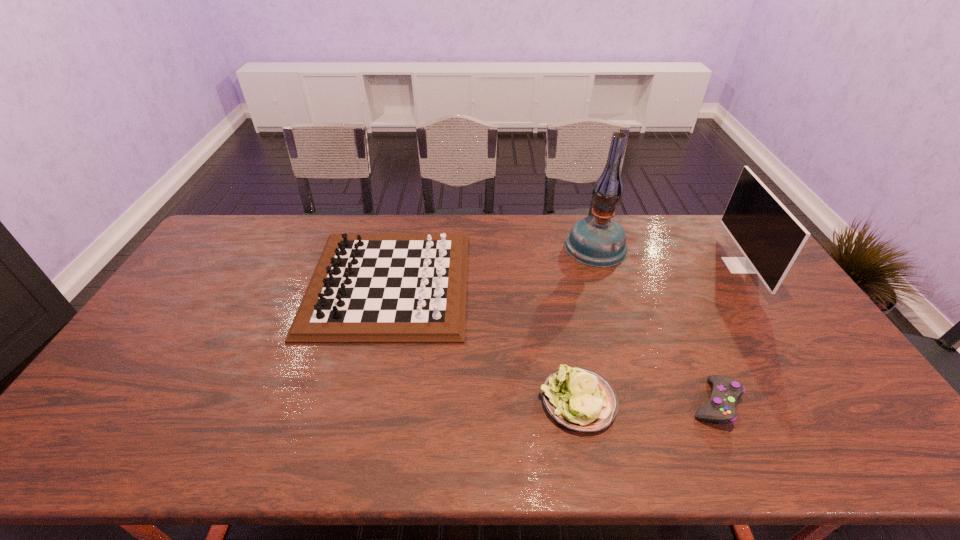
The image size is (960, 540). Identify the location of vacant area between the second shortest object and the leftmost object. (483, 342).

Locate an element on the screen. This screenshot has width=960, height=540. empty space between the lettuce and the shortest object is located at coordinates (646, 402).

Locate an element on the screen. This screenshot has width=960, height=540. free space between the second shortest object and the oil lamp is located at coordinates (x=587, y=323).

Identify the location of vacant space in between the lettuce and the control. This screenshot has width=960, height=540. (646, 402).

Locate an element on the screen. vacant region between the tallest object and the leftmost object is located at coordinates (492, 264).

Select which object is the second closest to the second shortest object. Please provide its 2D coordinates. Your answer should be formatted as a tuple, i.e. [(x, y)], where the tuple contains the x and y coordinates of a point satisfying the conditions above.

[(368, 288)]

Point out which object is positioned as the third nearest to the oil lamp. Please provide its 2D coordinates. Your answer should be formatted as a tuple, i.e. [(x, y)], where the tuple contains the x and y coordinates of a point satisfying the conditions above.

[(578, 398)]

The width and height of the screenshot is (960, 540). Find the location of `free spot that satisfies the following two spatial constraints: 1. on the front side of the control; 2. on the right side of the third shortest object`. free spot that satisfies the following two spatial constraints: 1. on the front side of the control; 2. on the right side of the third shortest object is located at coordinates (362, 402).

Where is `vacant point that satisfies the following two spatial constraints: 1. on the front-facing side of the rightmost object; 2. on the front side of the control`? The image size is (960, 540). vacant point that satisfies the following two spatial constraints: 1. on the front-facing side of the rightmost object; 2. on the front side of the control is located at coordinates [x=831, y=402].